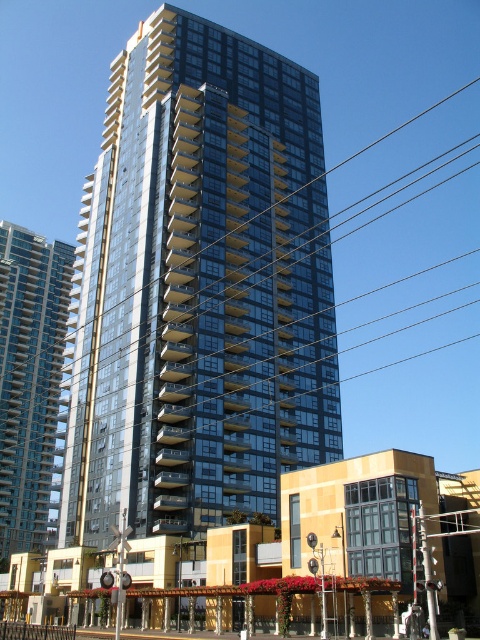
Based on the photo, who is positioned more to the right, glassy reflective building at center or transparent glass building at center?

glassy reflective building at center

This screenshot has width=480, height=640. I want to click on glassy reflective building at center, so click(x=200, y=289).